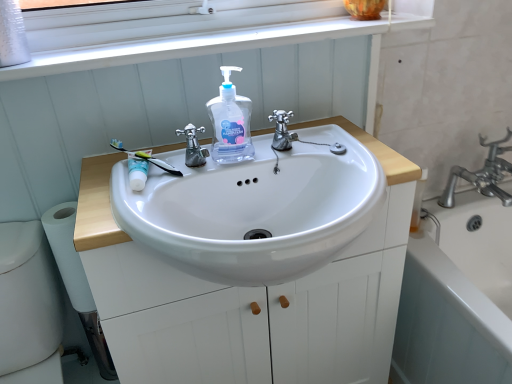
Question: Would you consider white ceramic bathtub at lower right to be distant from translucent plastic hand soap at center?

Choices:
 (A) yes
 (B) no

Answer: (B)

Question: Is white ceramic bathtub at lower right turned away from translucent plastic hand soap at center?

Choices:
 (A) yes
 (B) no

Answer: (B)

Question: Is white ceramic bathtub at lower right shorter than translucent plastic hand soap at center?

Choices:
 (A) no
 (B) yes

Answer: (A)

Question: Can we say white ceramic bathtub at lower right lies outside translucent plastic hand soap at center?

Choices:
 (A) yes
 (B) no

Answer: (A)

Question: Can you confirm if white ceramic bathtub at lower right is smaller than translucent plastic hand soap at center?

Choices:
 (A) no
 (B) yes

Answer: (A)

Question: Which is correct: white plastic window frame at upper center is inside green rubber toothbrush at upper left, or outside of it?

Choices:
 (A) outside
 (B) inside

Answer: (A)

Question: Considering the relative positions of white plastic window frame at upper center and green rubber toothbrush at upper left in the image provided, is white plastic window frame at upper center to the left or to the right of green rubber toothbrush at upper left?

Choices:
 (A) right
 (B) left

Answer: (A)

Question: Is point (223, 33) positioned closer to the camera than point (121, 147)?

Choices:
 (A) farther
 (B) closer

Answer: (A)

Question: Based on their sizes in the image, would you say white plastic window frame at upper center is bigger or smaller than green rubber toothbrush at upper left?

Choices:
 (A) big
 (B) small

Answer: (A)

Question: Would you say white matte cabinet at center is to the left or to the right of white matte toilet paper at lower left in the picture?

Choices:
 (A) left
 (B) right

Answer: (B)

Question: Is white matte cabinet at center wider or thinner than white matte toilet paper at lower left?

Choices:
 (A) wide
 (B) thin

Answer: (A)

Question: Is white matte cabinet at center in front of or behind white matte toilet paper at lower left in the image?

Choices:
 (A) front
 (B) behind

Answer: (A)

Question: Considering the positions of white matte cabinet at center and white matte toilet paper at lower left in the image, is white matte cabinet at center bigger or smaller than white matte toilet paper at lower left?

Choices:
 (A) small
 (B) big

Answer: (B)

Question: Considering the positions of white matte toilet paper at lower left and translucent plastic hand soap at center in the image, is white matte toilet paper at lower left taller or shorter than translucent plastic hand soap at center?

Choices:
 (A) short
 (B) tall

Answer: (B)

Question: Is point (56, 246) positioned closer to the camera than point (239, 135)?

Choices:
 (A) closer
 (B) farther

Answer: (B)